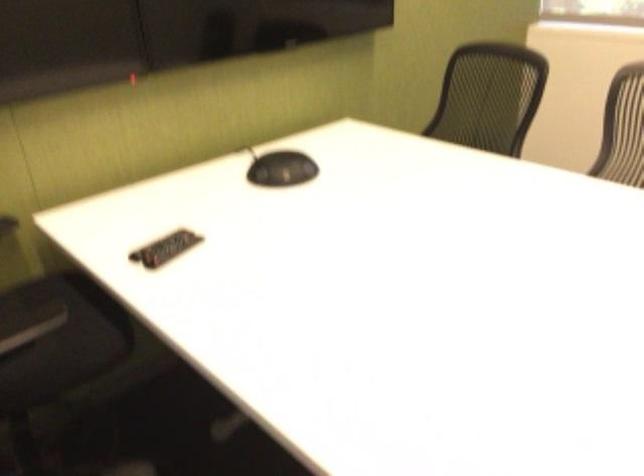
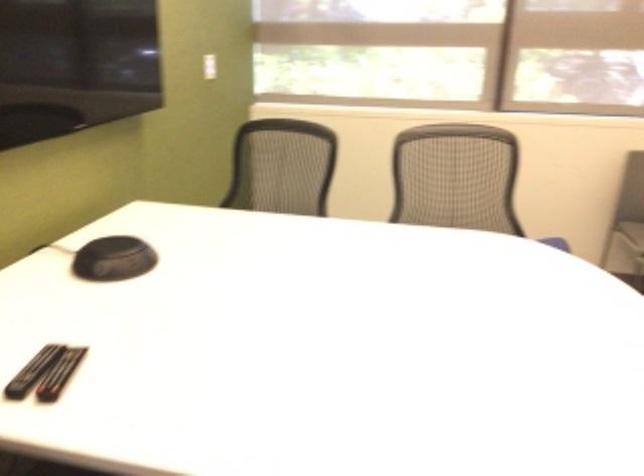
Where in the second image is the point corresponding to (x=163, y=251) from the first image?

(59, 374)